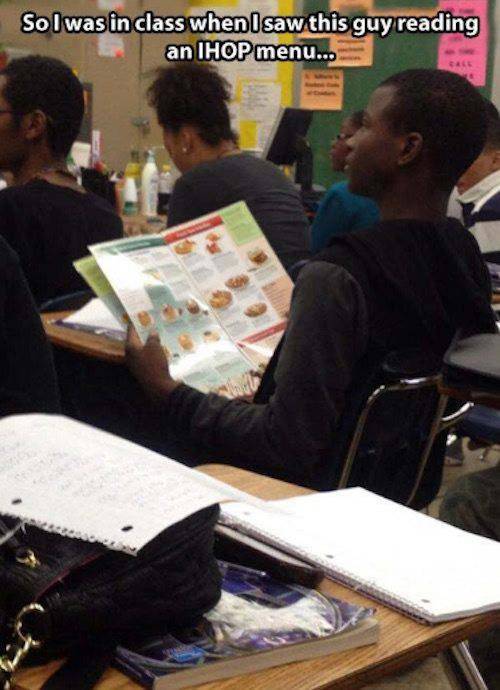
Find the location of a particular element. Image resolution: width=500 pixels, height=690 pixels. wooden desktop is located at coordinates coord(400,637).